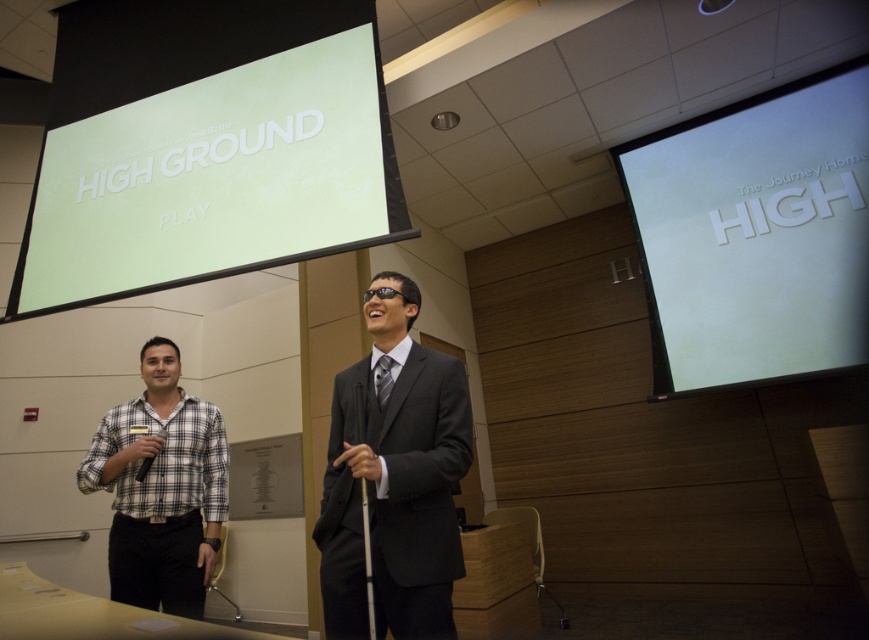
Question: Which of the following is the farthest from the observer?

Choices:
 (A) black plastic microphone at lower left
 (B) matte white screen at upper left
 (C) plaid shirt at left

Answer: (B)

Question: Is white matte projection screen at upper right positioned at the back of matte black suit at center?

Choices:
 (A) yes
 (B) no

Answer: (A)

Question: Which object is positioned closest to the matte black suit at center?

Choices:
 (A) black plastic microphone at lower left
 (B) white matte projection screen at upper right
 (C) matte white screen at upper left
 (D) plaid shirt at left

Answer: (D)

Question: Can you confirm if matte white screen at upper left is positioned below black plastic microphone at lower left?

Choices:
 (A) no
 (B) yes

Answer: (A)

Question: Can you confirm if white matte projection screen at upper right is bigger than matte black suit at center?

Choices:
 (A) yes
 (B) no

Answer: (A)

Question: Which of the following is the farthest from the observer?

Choices:
 (A) matte white screen at upper left
 (B) black plastic microphone at lower left
 (C) plaid shirt at left
 (D) matte black suit at center

Answer: (A)